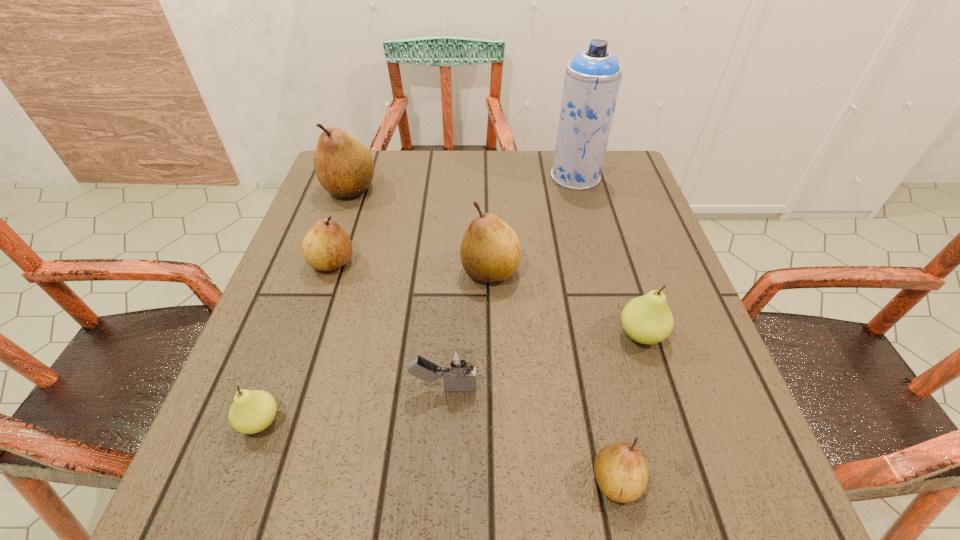
Find the location of `free space located 0.170m on the right of the fifth farthest pear`. free space located 0.170m on the right of the fifth farthest pear is located at coordinates (390, 421).

Locate an element on the screen. vacant space located on the right of the smallest brown pear is located at coordinates (676, 481).

You are a GUI agent. You are given a task and a screenshot of the screen. Output one action in this format:
    pyautogui.click(x=<x>, y=<y>)
    Task: Click on the aerosol can that is at the far edge
    This screenshot has height=540, width=960.
    Given the screenshot: What is the action you would take?
    pyautogui.click(x=593, y=77)

At what (x,y) coordinates should I click in order to perform the action: click on pear that is at the far edge. Please return your answer as a coordinate pair (x, y). The height and width of the screenshot is (540, 960). Looking at the image, I should click on (344, 167).

You are a GUI agent. You are given a task and a screenshot of the screen. Output one action in this format:
    pyautogui.click(x=<x>, y=<y>)
    Task: Click on the object that is at the near edge
    The image size is (960, 540).
    Given the screenshot: What is the action you would take?
    pyautogui.click(x=621, y=472)

Find the location of a particular element. The image size is (960, 540). aerosol can situated at the right edge is located at coordinates (593, 77).

The height and width of the screenshot is (540, 960). Identify the location of pear at the right edge. (647, 319).

Find the location of `object situated at the far left corner`. object situated at the far left corner is located at coordinates (x=344, y=167).

The image size is (960, 540). In order to click on object that is positioned at the far right corner in this screenshot , I will do `click(593, 77)`.

What are the coordinates of `free space at the far edge of the desktop` in the screenshot? It's located at (421, 179).